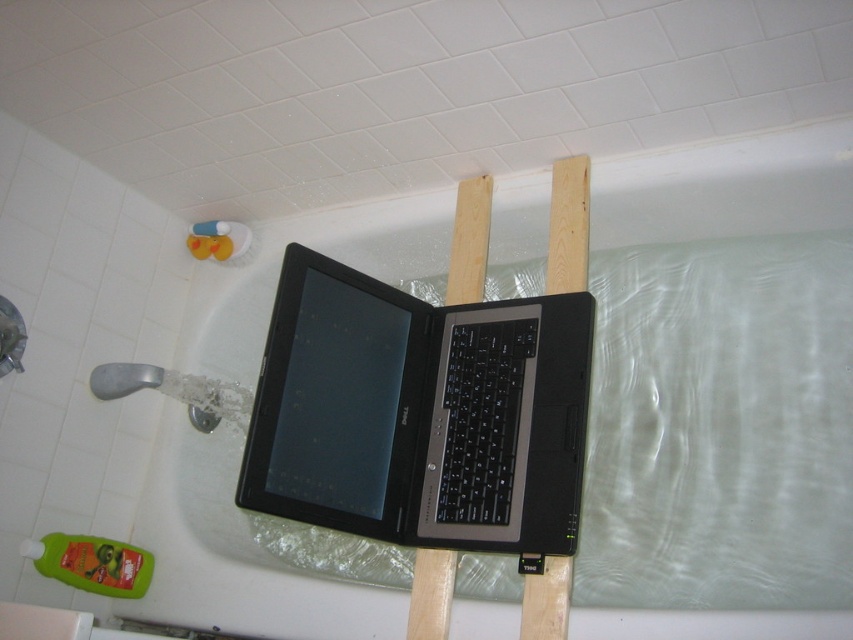
Describe the element at coordinates (233, 554) in the screenshot. I see `clear plastic bath at upper center` at that location.

Is point (779, 161) closer to viewer compared to point (564, 627)?

No, (779, 161) is behind (564, 627).

The image size is (853, 640). Describe the element at coordinates (233, 554) in the screenshot. I see `clear plastic bath at upper center` at that location.

The height and width of the screenshot is (640, 853). I want to click on clear plastic bath at upper center, so click(233, 554).

Is point (560, 637) farther from viewer compared to point (456, 291)?

No, it is in front of (456, 291).

In the scene shown: Which of these two, wooden plank at upper center or wooden plank at center, stands shorter?

Standing shorter between the two is wooden plank at center.

This screenshot has width=853, height=640. What do you see at coordinates (567, 225) in the screenshot? I see `wooden plank at upper center` at bounding box center [567, 225].

The height and width of the screenshot is (640, 853). Find the location of `wooden plank at upper center`. wooden plank at upper center is located at coordinates (567, 225).

Which is more to the left, black matte laptop at center or wooden plank at upper center?

From the viewer's perspective, black matte laptop at center appears more on the left side.

Which of these two, black matte laptop at center or wooden plank at upper center, stands taller?

Standing taller between the two is black matte laptop at center.

Which is behind, point (462, 490) or point (531, 586)?

Positioned behind is point (462, 490).

This screenshot has height=640, width=853. In order to click on black matte laptop at center in this screenshot , I will do `click(419, 413)`.